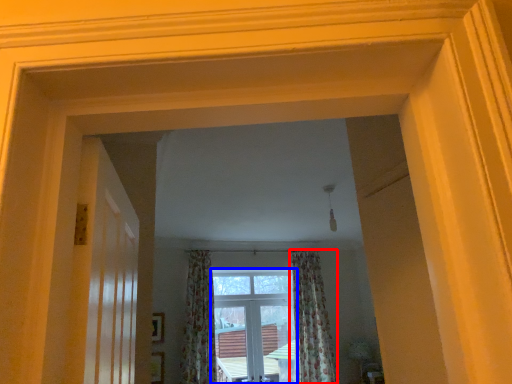
Question: Among these objects, which one is farthest to the camera, curtain (highlighted by a red box) or window (highlighted by a blue box)?

Choices:
 (A) curtain
 (B) window

Answer: (B)